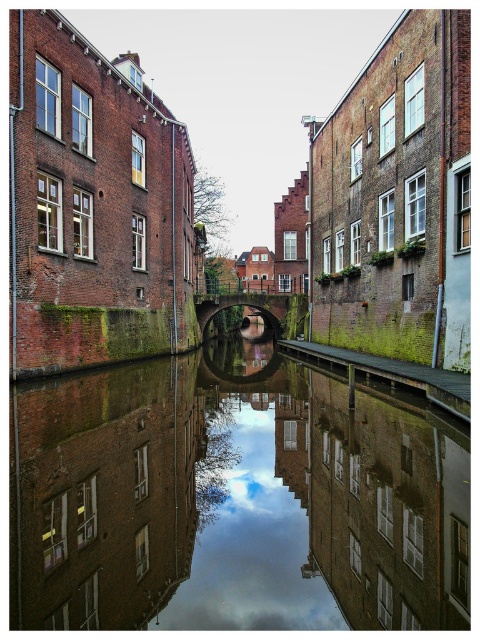
You are a tourist standing at the edge of the canal and want to take a photo of the smooth reflective water at center and the green mossy brick alley at lower right. Which object is closer to you, the tourist?

The smooth reflective water at center is closer to you because it is in front of the green mossy brick alley at lower right.